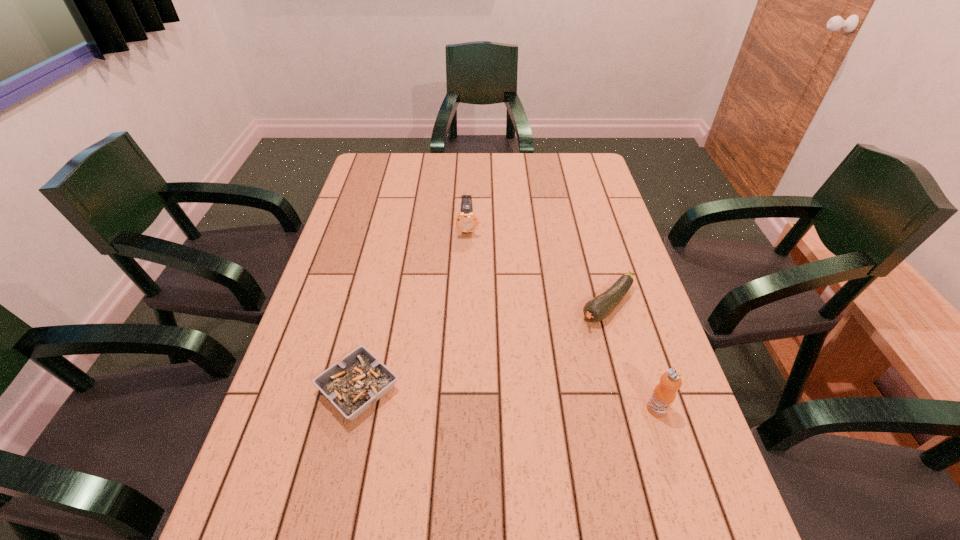
Locate an element on the screen. vacant space on the desktop that is between the shortest object and the orange juice and is positioned on the face of the second object from left to right is located at coordinates (470, 396).

You are a GUI agent. You are given a task and a screenshot of the screen. Output one action in this format:
    pyautogui.click(x=<x>, y=<y>)
    Task: Click on the free space on the desktop that is between the shortest object and the tallest object and is positioned at the blossom end of the third nearest object
    
    Given the screenshot: What is the action you would take?
    pyautogui.click(x=494, y=398)